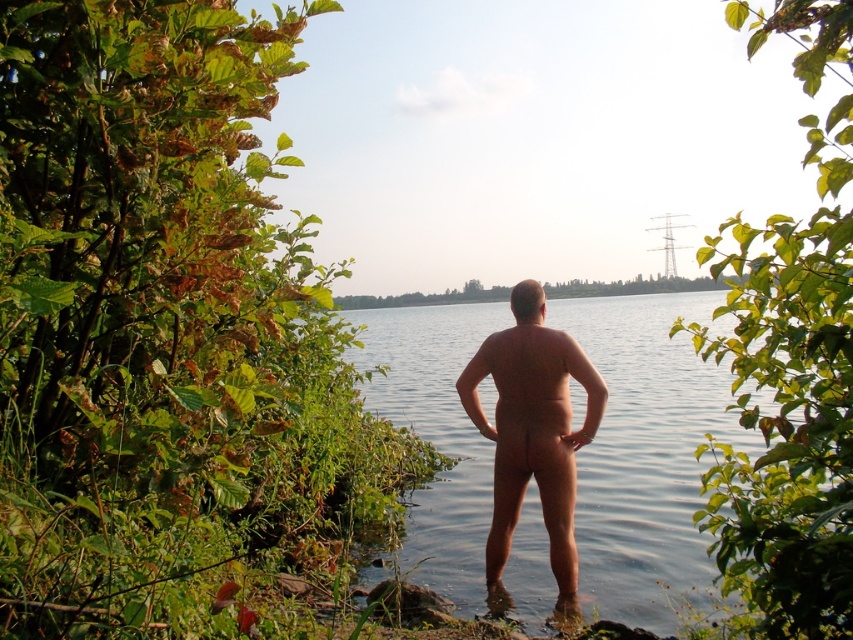
Question: Can you confirm if green leafy shrubs at left is positioned to the left of clear water at center?

Choices:
 (A) yes
 (B) no

Answer: (A)

Question: Which of the following is the farthest from the observer?

Choices:
 (A) (564, 500)
 (B) (766, 465)
 (C) (531, 484)

Answer: (C)

Question: Can you confirm if green leafy shrubs at left is bigger than green leafy shrub at upper right?

Choices:
 (A) yes
 (B) no

Answer: (A)

Question: Which of the following is the closest to the observer?

Choices:
 (A) (500, 369)
 (B) (544, 540)

Answer: (A)

Question: Which object appears farthest from the camera in this image?

Choices:
 (A) skinny naked man at center
 (B) green leafy shrub at upper right
 (C) green leafy shrubs at left

Answer: (A)

Question: Does green leafy shrub at upper right have a larger size compared to skinny naked man at center?

Choices:
 (A) yes
 (B) no

Answer: (A)